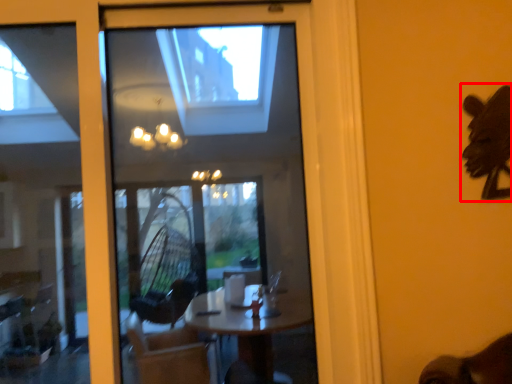
Question: Where is animal (annotated by the red box) located in relation to window in the image?

Choices:
 (A) right
 (B) left

Answer: (A)